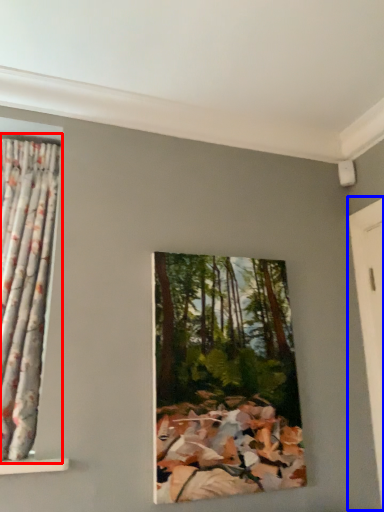
Question: Which object appears farthest to the camera in this image, curtain (highlighted by a red box) or door (highlighted by a blue box)?

Choices:
 (A) curtain
 (B) door

Answer: (B)